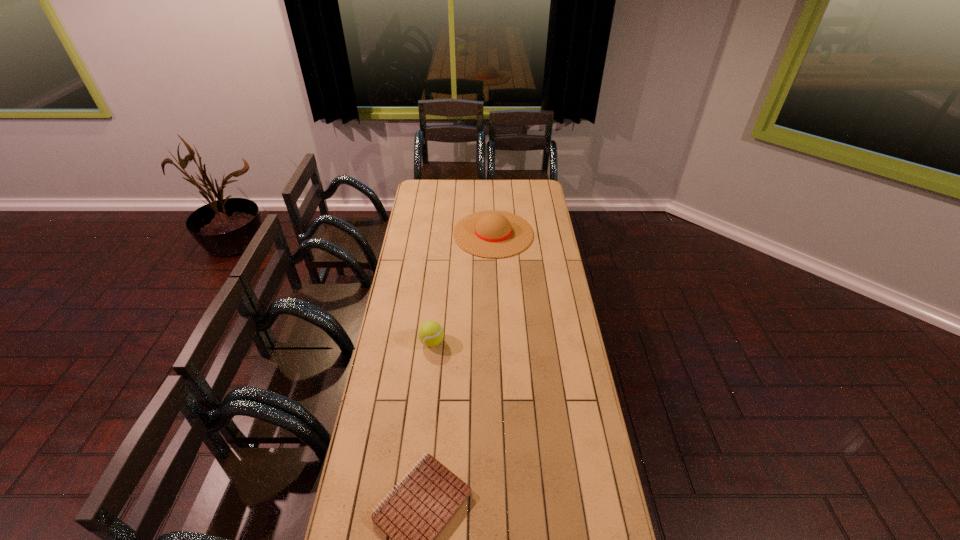
Where is `the farthest object`? the farthest object is located at coordinates (489, 234).

Image resolution: width=960 pixels, height=540 pixels. I want to click on the second nearest object, so click(x=431, y=333).

Where is `vacant space positioned on the front of the farthest object`? vacant space positioned on the front of the farthest object is located at coordinates (495, 275).

Where is `free space located 0.120m on the left of the tennis ball`? The width and height of the screenshot is (960, 540). free space located 0.120m on the left of the tennis ball is located at coordinates (392, 342).

At what (x,y) coordinates should I click in order to perform the action: click on object located in the left edge section of the desktop. Please return your answer as a coordinate pair (x, y). Looking at the image, I should click on (431, 333).

Find the location of `object at the right edge`. object at the right edge is located at coordinates (489, 234).

The height and width of the screenshot is (540, 960). Identify the location of vacant region at the far edge. (498, 193).

The image size is (960, 540). What are the coordinates of `vacant space at the left edge of the desktop` in the screenshot? It's located at (394, 389).

At what (x,y) coordinates should I click in order to perform the action: click on vacant space at the right edge of the desktop. Please return your answer as a coordinate pair (x, y). The image size is (960, 540). Looking at the image, I should click on [x=566, y=328].

In the image, there is a desktop. Where is `free space at the far left corner`? The height and width of the screenshot is (540, 960). free space at the far left corner is located at coordinates (420, 194).